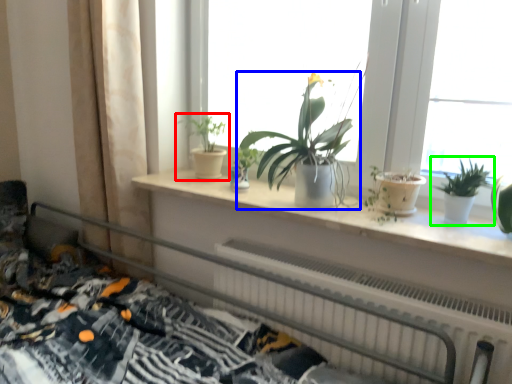
Question: Which object is the farthest from houseplant (highlighted by a red box)? Choose among these: houseplant (highlighted by a blue box) or houseplant (highlighted by a green box).

Choices:
 (A) houseplant
 (B) houseplant

Answer: (B)